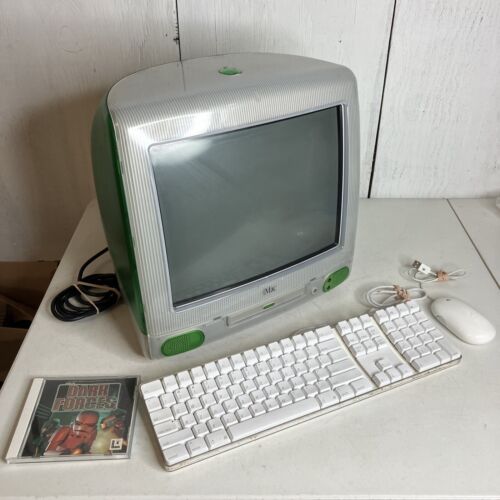
The width and height of the screenshot is (500, 500). What are the coordinates of `computer mouse` in the screenshot? It's located at (458, 326).